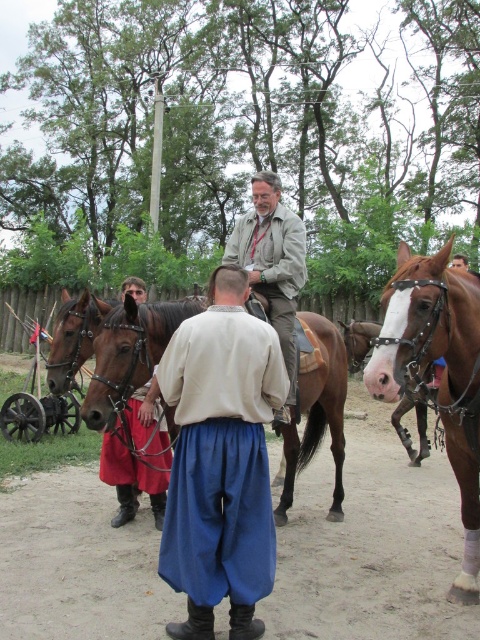
Who is more forward, (88, 342) or (256, 282)?

Point (88, 342) is more forward.

Is point (107, 317) closer to viewer compared to point (269, 280)?

Yes, point (107, 317) is in front of point (269, 280).

This screenshot has height=640, width=480. Find the location of `brown leather horse at center`. brown leather horse at center is located at coordinates click(111, 348).

The image size is (480, 640). What are the coordinates of `brown leather horse at center` in the screenshot? It's located at (111, 348).

Can you confirm if brown leather horse at center is positioned to the left of brown glossy horse at center?

Indeed, brown leather horse at center is positioned on the left side of brown glossy horse at center.

What do you see at coordinates (111, 348) in the screenshot? The height and width of the screenshot is (640, 480). I see `brown leather horse at center` at bounding box center [111, 348].

Where is `brown leather horse at center`? Image resolution: width=480 pixels, height=640 pixels. brown leather horse at center is located at coordinates (111, 348).

Is blue cotton robe at center bigger than light brown leather jacket at center?

Indeed, blue cotton robe at center has a larger size compared to light brown leather jacket at center.

Between blue cotton robe at center and light brown leather jacket at center, which one has less height?

With less height is light brown leather jacket at center.

Who is more forward, [265,342] or [263,230]?

Positioned in front is point [265,342].

Find the location of `blue cotton robe at center`. blue cotton robe at center is located at coordinates (220, 456).